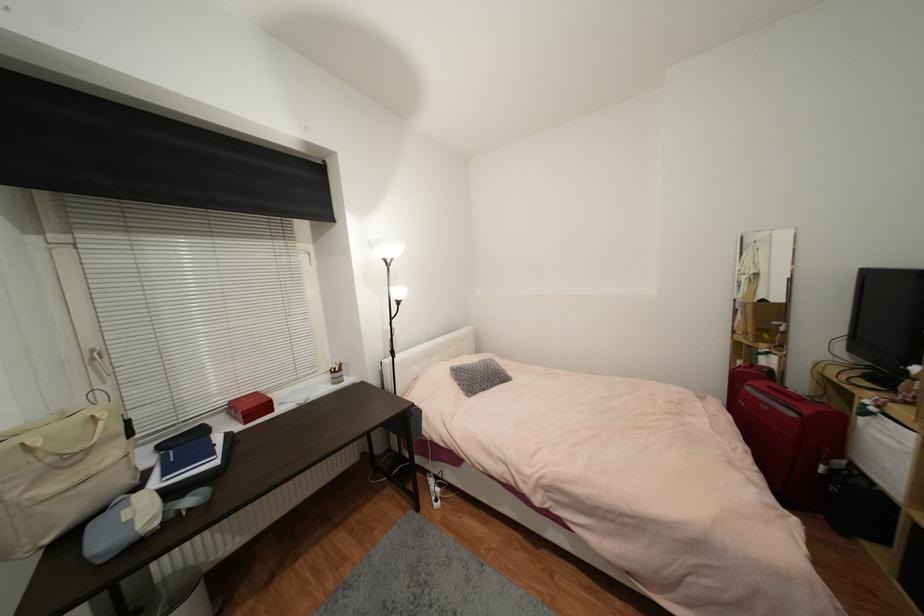
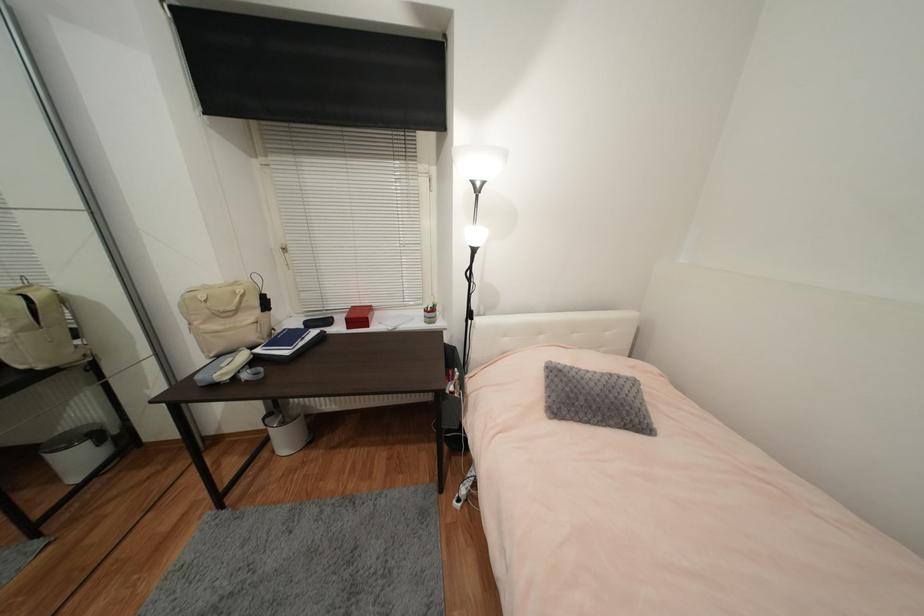
Locate, in the second image, the point that corresponds to pixel 224 451 in the first image.

(306, 344)